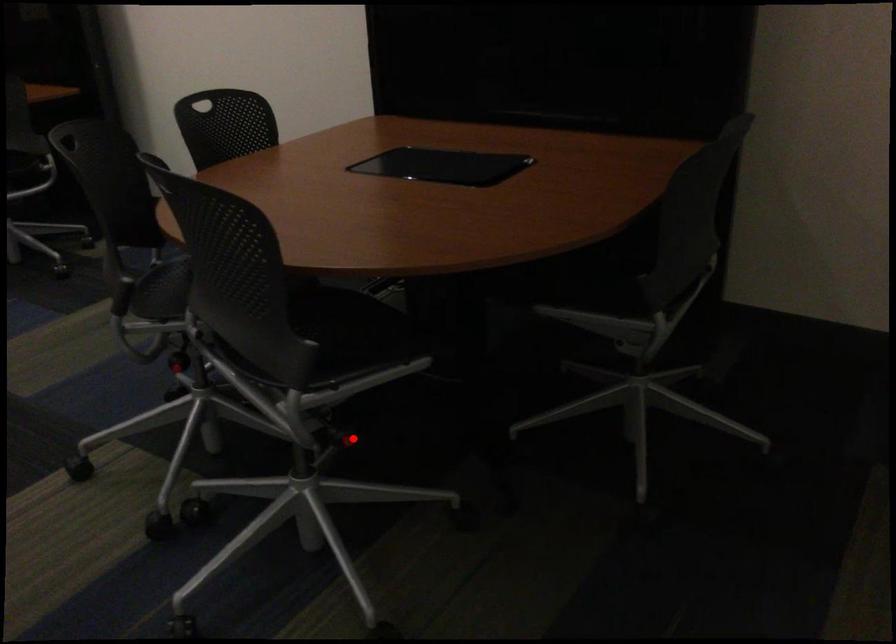
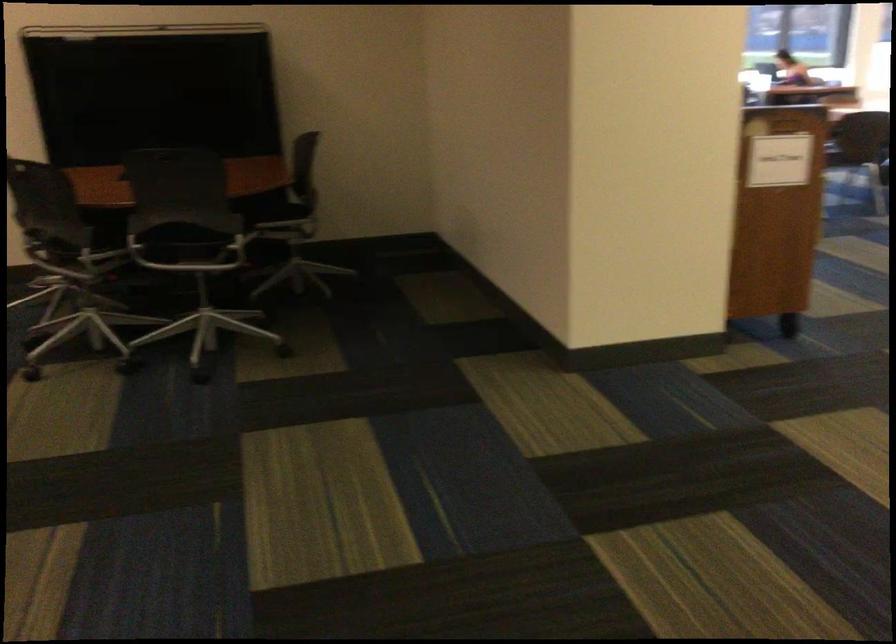
Question: I am providing you with two images of the same scene from different viewpoints. A red point is marked on the first image. Can you still see the location of the red point in image 2?

Choices:
 (A) Yes
 (B) No

Answer: (B)